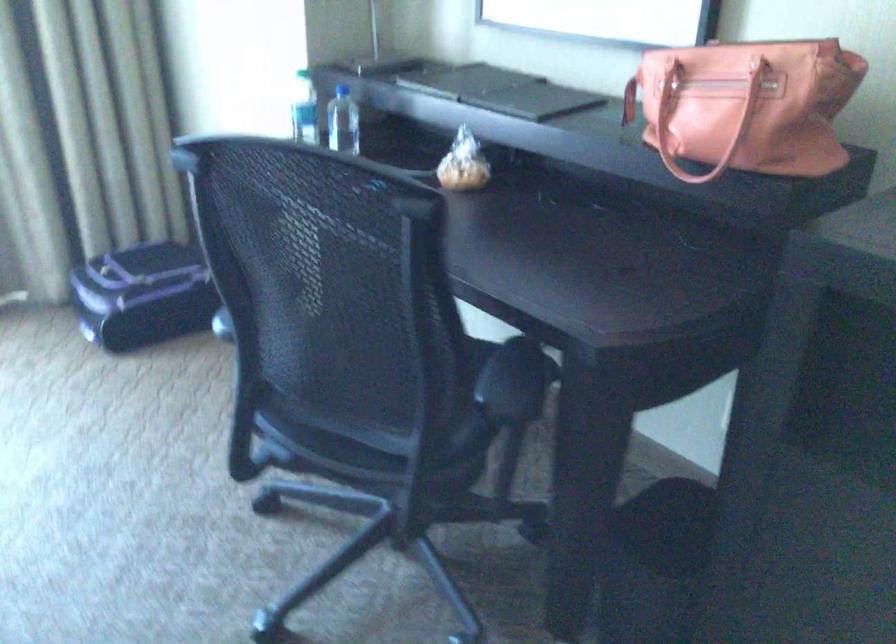
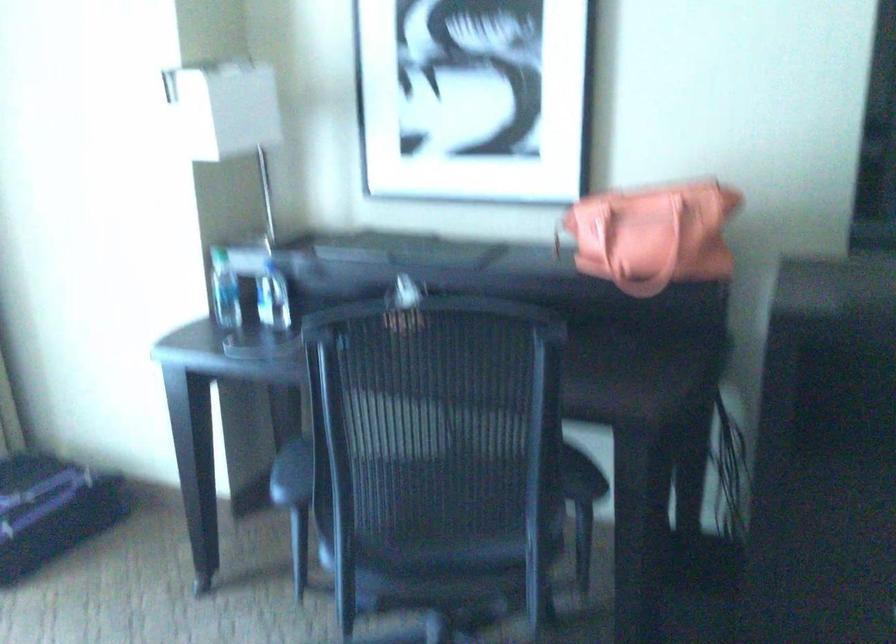
Question: I am providing you with two images of the same scene from different viewpoints. Please identify which objects are invisible in image2.

Choices:
 (A) white fluffy stool
 (B) chair armrest
 (C) small wrapped pastry
 (D) orange handbag handle

Answer: (C)